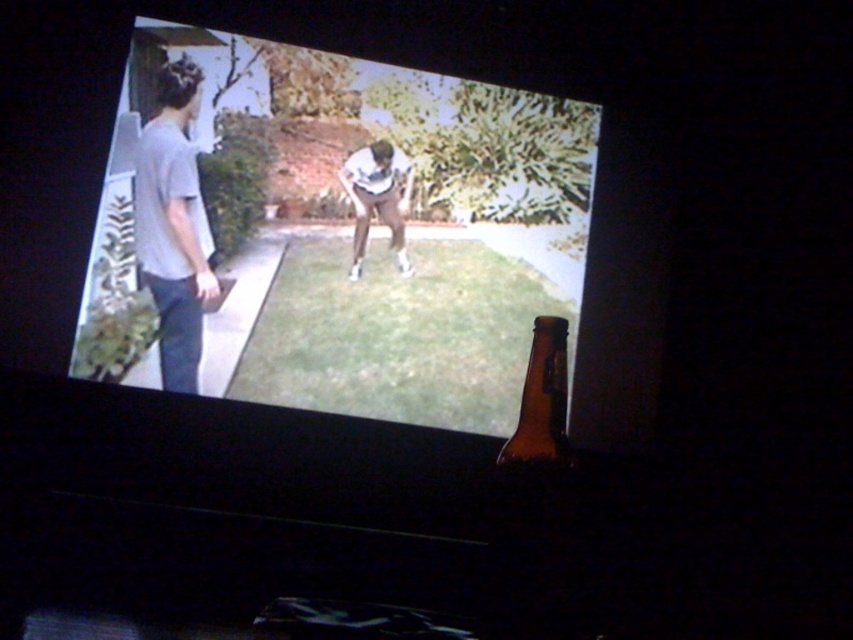
Is gray cotton t-shirt at left above brown glass bottle at lower right?

Yes, gray cotton t-shirt at left is above brown glass bottle at lower right.

Which is in front, point (204, 268) or point (555, 316)?

Point (555, 316) is in front.

Does point (169, 68) lie behind point (538, 326)?

Yes, it is.

The image size is (853, 640). What are the coordinates of `gray cotton t-shirt at left` in the screenshot? It's located at (173, 225).

Measure the distance between point [566,376] and camera.

A distance of 54.46 centimeters exists between point [566,376] and camera.

Who is more forward, (566, 349) or (396, 259)?

Positioned in front is point (566, 349).

At what (x,y) coordinates should I click in order to perform the action: click on brown glass bottle at lower right. Please return your answer as a coordinate pair (x, y). This screenshot has width=853, height=640. Looking at the image, I should click on (541, 406).

Locate an element on the screen. brown glass bottle at lower right is located at coordinates (541, 406).

Between gray cotton t-shirt at left and light gray fabric pants at center, which one is positioned lower?

gray cotton t-shirt at left is below.

Which is behind, point (178, 97) or point (408, 260)?

The point (408, 260) is behind.

Identify the location of gray cotton t-shirt at left. This screenshot has height=640, width=853. (x=173, y=225).